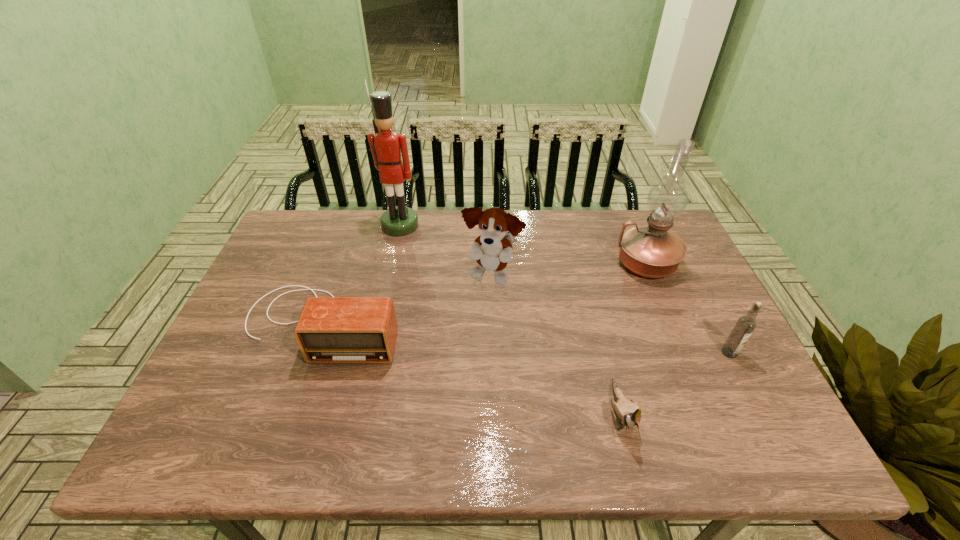
Locate an element on the screen. This screenshot has width=960, height=540. free space between the tallest object and the fifth shortest object is located at coordinates (523, 244).

Locate an element on the screen. The height and width of the screenshot is (540, 960). free space between the radio receiver and the puppy is located at coordinates (407, 300).

Find the location of a particular element. This screenshot has height=540, width=960. vacant area between the vodka and the fifth shortest object is located at coordinates (687, 308).

Where is `free spot between the fourth tallest object and the tallest object`? The height and width of the screenshot is (540, 960). free spot between the fourth tallest object and the tallest object is located at coordinates (564, 289).

This screenshot has height=540, width=960. Find the location of `empty space between the radio receiver and the bird`. empty space between the radio receiver and the bird is located at coordinates (471, 368).

Identify the location of free space between the nearest object and the third shortest object. (675, 383).

Image resolution: width=960 pixels, height=540 pixels. I want to click on free point between the tallest object and the radio receiver, so click(x=361, y=274).

Locate an element on the screen. This screenshot has width=960, height=540. empty location between the tallest object and the puppy is located at coordinates (445, 251).

Find the location of a particular element. The width and height of the screenshot is (960, 540). object that stands as the closest to the farthest object is located at coordinates (492, 250).

You are a GUI agent. You are given a task and a screenshot of the screen. Output one action in this format:
    pyautogui.click(x=<x>, y=<y>)
    Task: Click on the object that is the fifth closest to the farthest object
    This screenshot has height=540, width=960.
    Given the screenshot: What is the action you would take?
    pyautogui.click(x=745, y=325)